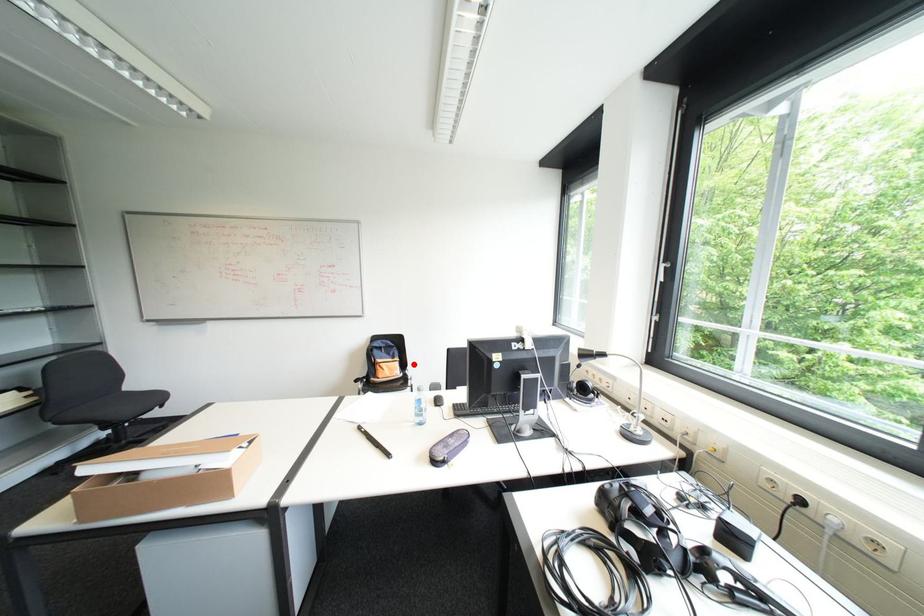
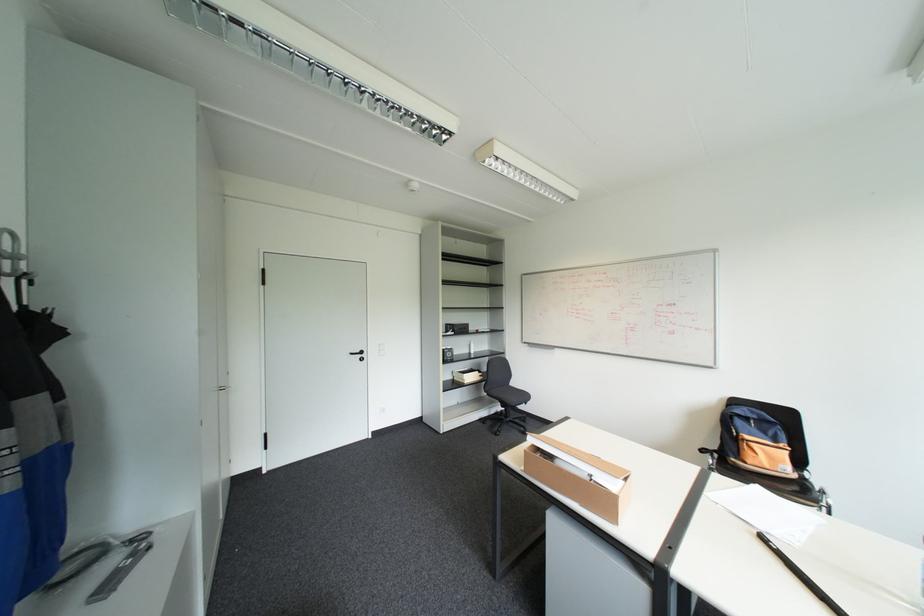
Question: I am providing you with two images of the same scene from different viewpoints. In image1, a red point is highlighted. Considering the same 3D point in image2, which of the following is correct?

Choices:
 (A) It is closer
 (B) It is farther

Answer: (A)